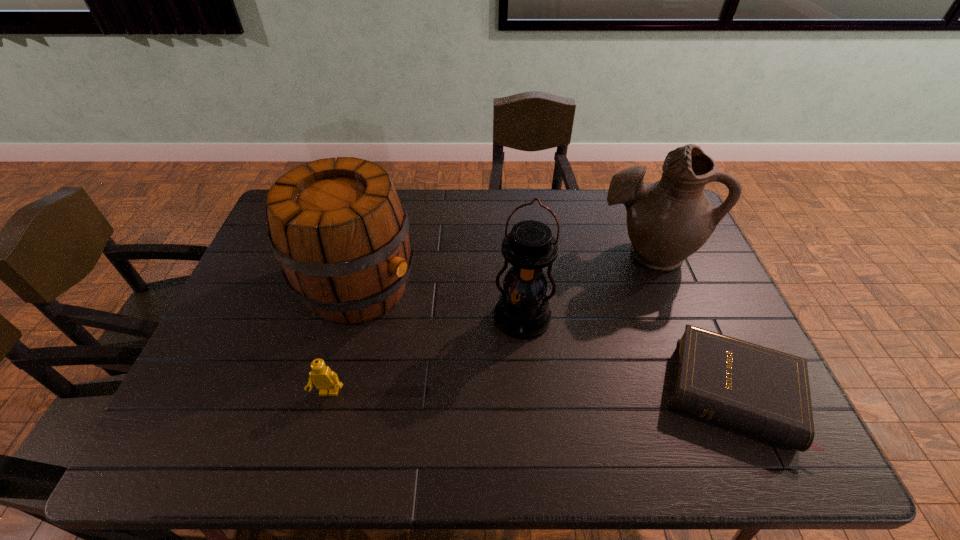
In order to click on free spot on the desktop that is between the Lego and the Bible and is positioned above the lantern, indicating its light source in this screenshot , I will do `click(508, 393)`.

Identify the location of vacant space on the desktop that is between the fourth tallest object and the shortest object and is positioned at the spout of the pitcher. The width and height of the screenshot is (960, 540). (528, 393).

You are a GUI agent. You are given a task and a screenshot of the screen. Output one action in this format:
    pyautogui.click(x=<x>, y=<y>)
    Task: Click on the free space on the desktop that is between the Lego and the shortest object and is positioned on the side of the cider where the spigot is located
    
    Given the screenshot: What is the action you would take?
    pyautogui.click(x=568, y=393)